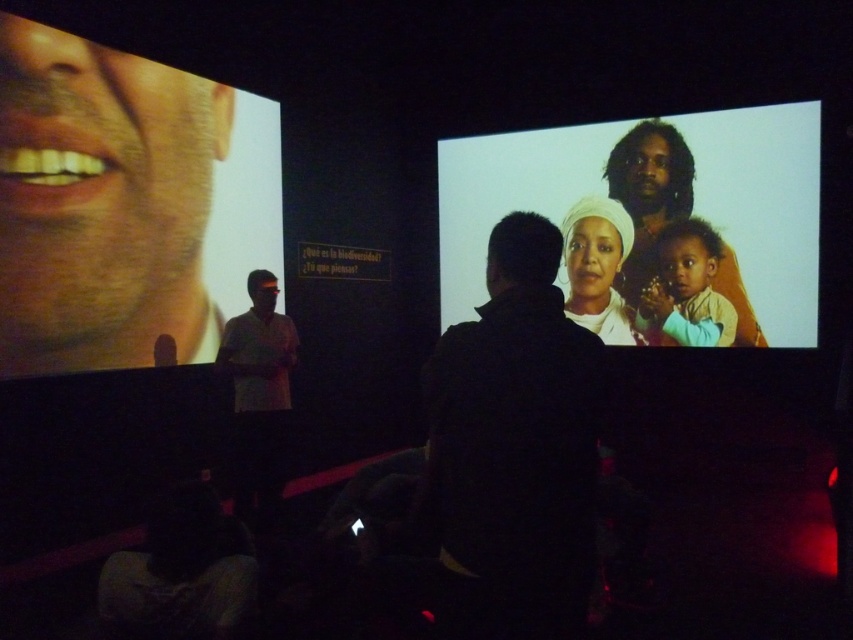
You are standing in a room with two large screens. You need to locate the matte white family portrait at upper right. Where exactly is it positioned?

The matte white family portrait at upper right is positioned at point (653, 221).

You are standing in the room and notice two points marked on the wall. The first point is at coordinates point(x=523, y=300) and the second is at point(x=640, y=195). Which point is closer to you?

Point(x=523, y=300) is closer to the camera than point(x=640, y=195), so the first point is closer to you.

You are a photographer in a cinema setting. You need to capture a photo of both the matte white family portrait at upper right and the white matte headscarf at center. Given that your camera has a maximum focus range of 35 centimeters, will you be able to include both objects in a single focused shot?

The matte white family portrait at upper right and white matte headscarf at center are 36.03 centimeters apart. Since the distance between them exceeds the camera maximum focus range of 35 centimeters, you cannot include both objects in a single focused shot.